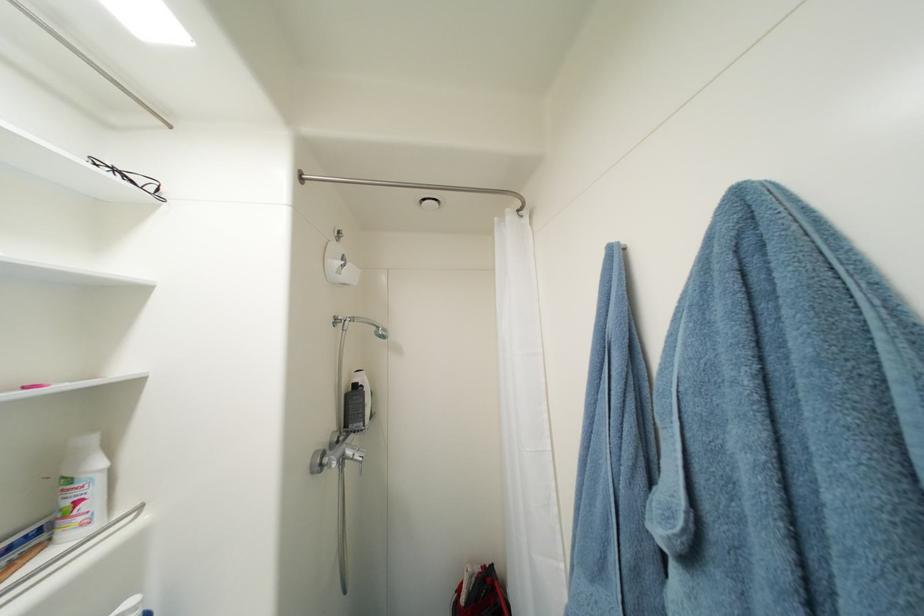
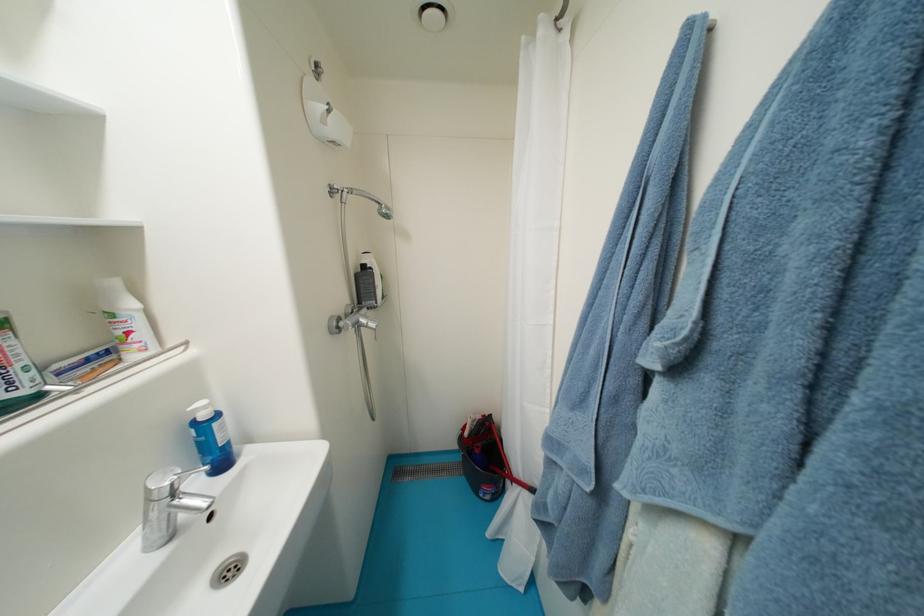
From the picture: In a continuous first-person perspective shot, in which direction is the camera moving?

The cameraman walked toward right, forward.